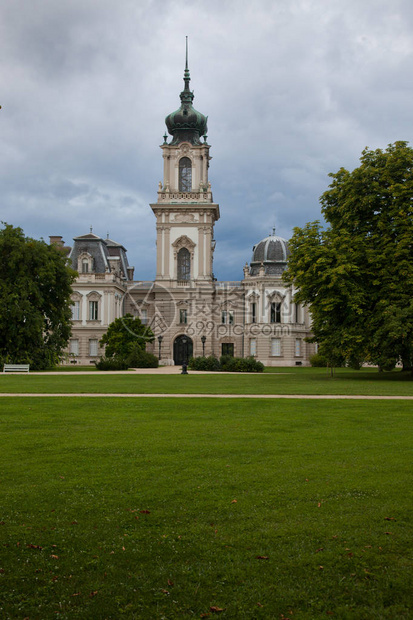
The width and height of the screenshot is (413, 620). I want to click on lamp, so click(202, 339), click(159, 338), click(183, 341).